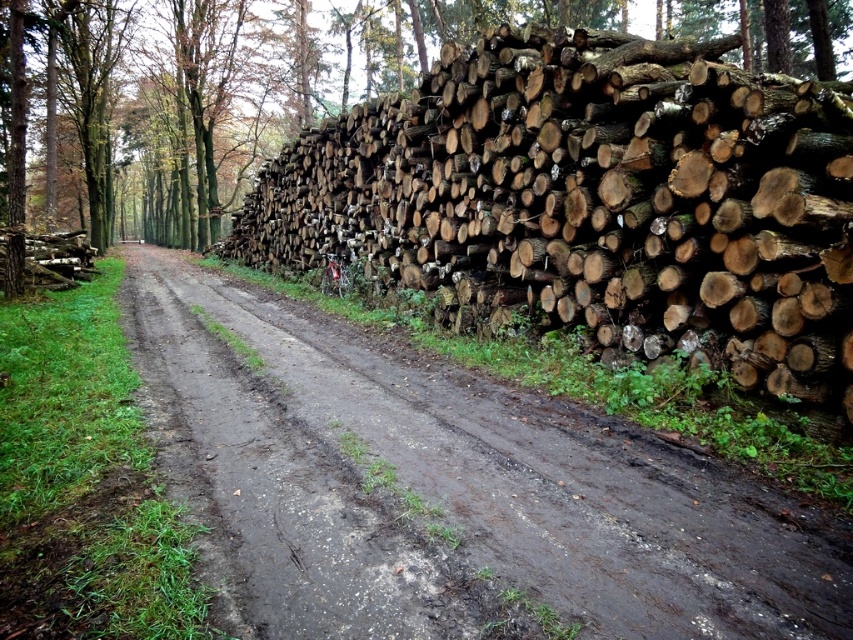
You are standing at the point marked by coordinates point (593,200) in the image. Based on the scene described, what natural material can you see around you?

The point (593,200) indicates natural wood logs at right, so you are surrounded by natural wood logs.

You are standing at the edge of the dirt road in the rural forest scene. You notice two points marked on the road surface. The first point is at coordinates point (339,248) and the second is at point (202,397). If you want to walk towards the nearest point to you, which coordinate should you head towards?

You should head towards point (202,397) because it is closer to you than point (339,248), which is further away.